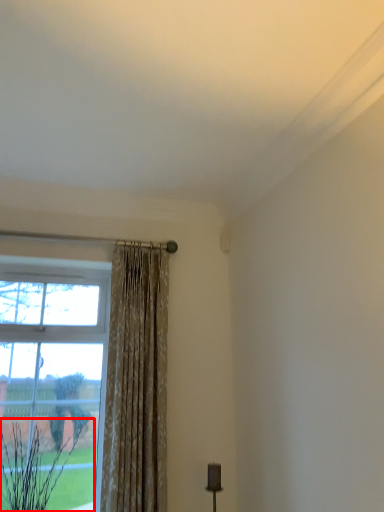
Question: In this image, where is plant (annotated by the red box) located relative to curtain?

Choices:
 (A) left
 (B) right

Answer: (A)